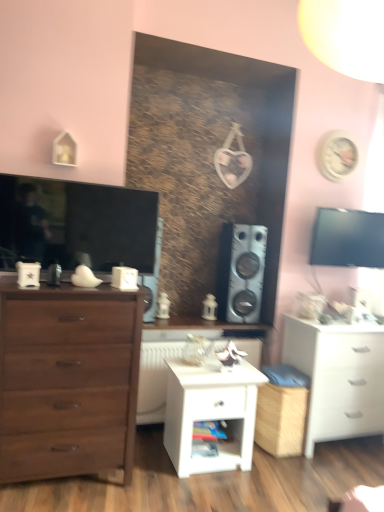
Question: From the image's perspective, would you say metallic silver speaker at center-right is positioned over matte brown chest of drawers at left, acting as the second chest of drawers starting from the right?

Choices:
 (A) no
 (B) yes

Answer: (B)

Question: Is metallic silver speaker at center-right aimed at matte brown chest of drawers at left, which ranks as the first chest of drawers in front-to-back order?

Choices:
 (A) no
 (B) yes

Answer: (A)

Question: Considering the relative sizes of metallic silver speaker at center-right and matte brown chest of drawers at left, which ranks as the 2th chest of drawers in back-to-front order, in the image provided, is metallic silver speaker at center-right wider than matte brown chest of drawers at left, which ranks as the 2th chest of drawers in back-to-front order,?

Choices:
 (A) yes
 (B) no

Answer: (B)

Question: Does metallic silver speaker at center-right come behind matte brown chest of drawers at left, acting as the second chest of drawers starting from the right?

Choices:
 (A) yes
 (B) no

Answer: (A)

Question: Is metallic silver speaker at center-right not within matte brown chest of drawers at left, which ranks as the first chest of drawers in front-to-back order?

Choices:
 (A) no
 (B) yes

Answer: (B)

Question: Is the depth of metallic silver speaker at center-right less than that of matte brown chest of drawers at left, which ranks as the first chest of drawers in front-to-back order?

Choices:
 (A) no
 (B) yes

Answer: (A)

Question: Does matte black television at left come behind white matte chest of drawers at lower right, which ranks as the second chest of drawers in front-to-back order?

Choices:
 (A) yes
 (B) no

Answer: (B)

Question: Can you confirm if matte black television at left is wider than white matte chest of drawers at lower right, which ranks as the second chest of drawers in left-to-right order?

Choices:
 (A) no
 (B) yes

Answer: (A)

Question: Would you say white matte chest of drawers at lower right, which ranks as the second chest of drawers in left-to-right order, is part of matte black television at left's contents?

Choices:
 (A) yes
 (B) no

Answer: (B)

Question: Is matte black television at left outside of white matte chest of drawers at lower right, which ranks as the second chest of drawers in front-to-back order?

Choices:
 (A) no
 (B) yes

Answer: (B)

Question: Can you confirm if matte black television at left is taller than white matte chest of drawers at lower right, which ranks as the second chest of drawers in left-to-right order?

Choices:
 (A) yes
 (B) no

Answer: (B)

Question: From a real-world perspective, is matte black television at left located beneath white matte chest of drawers at lower right, the 1th chest of drawers when ordered from right to left?

Choices:
 (A) yes
 (B) no

Answer: (B)

Question: Does wooden shelf at center contain white plastic radiator at center?

Choices:
 (A) no
 (B) yes

Answer: (A)